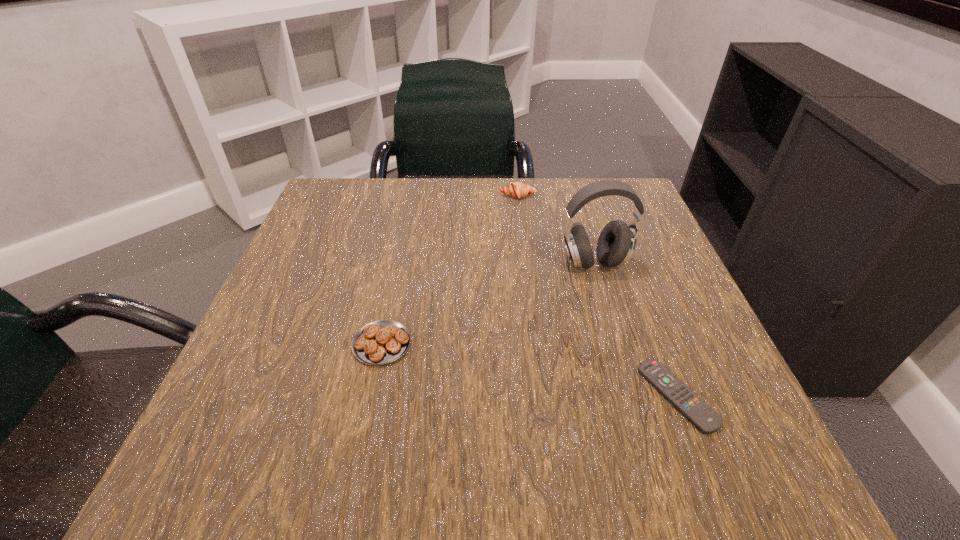
Where is `blank space located 0.290m on the left of the remote control`? blank space located 0.290m on the left of the remote control is located at coordinates (448, 396).

Locate an element on the screen. object that is at the far edge is located at coordinates (518, 190).

This screenshot has height=540, width=960. Find the location of `object that is positioned at the near edge`. object that is positioned at the near edge is located at coordinates pos(701,415).

You are a GUI agent. You are given a task and a screenshot of the screen. Output one action in this format:
    pyautogui.click(x=<x>, y=<y>)
    Task: Click on the headset that is positioned at the right edge
    
    Given the screenshot: What is the action you would take?
    pyautogui.click(x=616, y=243)

The width and height of the screenshot is (960, 540). What are the coordinates of `remote control present at the right edge` in the screenshot? It's located at (701, 415).

This screenshot has height=540, width=960. In order to click on object positioned at the near right corner in this screenshot , I will do `click(701, 415)`.

This screenshot has width=960, height=540. In the image, there is a desktop. What are the coordinates of `free space at the far edge` in the screenshot? It's located at (536, 178).

Where is `free region at the near edge of the desktop`? The height and width of the screenshot is (540, 960). free region at the near edge of the desktop is located at coordinates (538, 422).

Find the location of a particular element. The height and width of the screenshot is (540, 960). free location at the left edge is located at coordinates (270, 301).

This screenshot has width=960, height=540. I want to click on blank space at the right edge of the desktop, so click(655, 390).